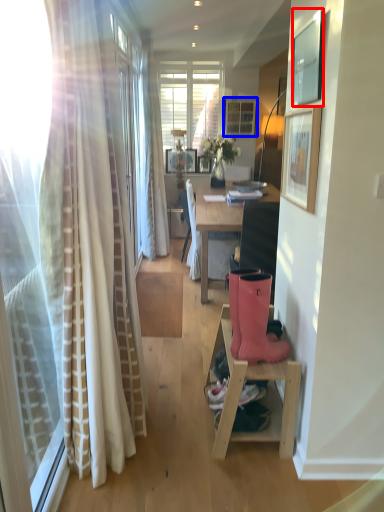
Question: Which point is closer to the camera, picture frame (highlighted by a red box) or picture frame (highlighted by a blue box)?

Choices:
 (A) picture frame
 (B) picture frame

Answer: (A)